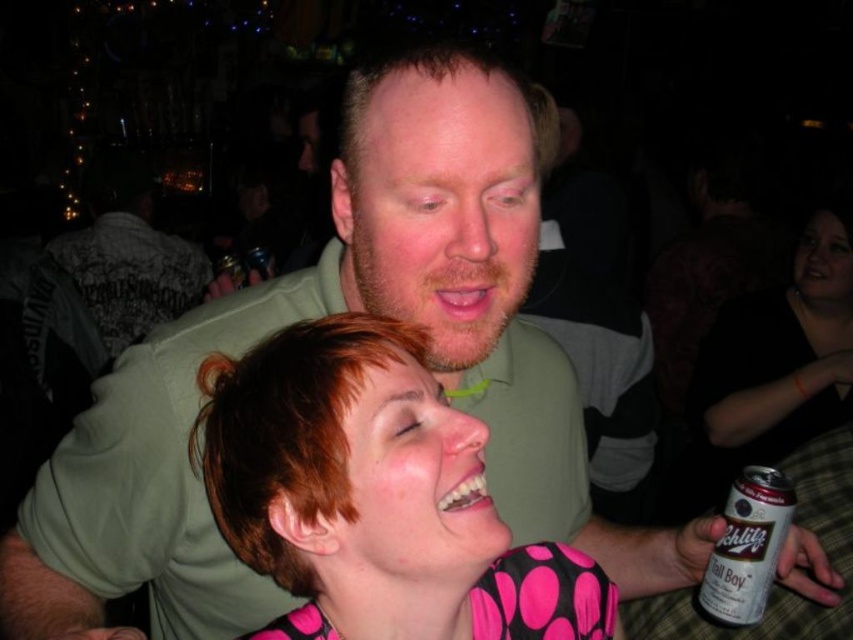
Can you confirm if pink dotted shirt at center is positioned below silver metallic can at lower right?

Actually, pink dotted shirt at center is above silver metallic can at lower right.

Consider the image. Between pink dotted shirt at center and silver metallic can at lower right, which one is positioned higher?

pink dotted shirt at center is higher up.

At what (x,y) coordinates should I click in order to perform the action: click on pink dotted shirt at center. Please return your answer as a coordinate pair (x, y). Looking at the image, I should click on coord(375,497).

Can you confirm if black matte can at lower right is thinner than matte green shirt at upper center?

Yes.

Between point (788, 410) and point (163, 275), which one is positioned behind?

Point (163, 275)

This screenshot has height=640, width=853. Describe the element at coordinates (781, 355) in the screenshot. I see `black matte can at lower right` at that location.

Identify the location of black matte can at lower right. The height and width of the screenshot is (640, 853). (781, 355).

Can you confirm if pink dotted shirt at center is positioned above matte green shirt at upper center?

Actually, pink dotted shirt at center is below matte green shirt at upper center.

Which is in front, point (546, 600) or point (132, 225)?

Point (546, 600) is more forward.

Find the location of a particular element. This screenshot has height=640, width=853. pink dotted shirt at center is located at coordinates [375, 497].